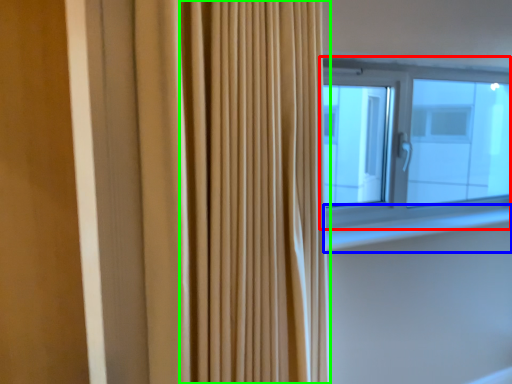
Question: Which is nearer to the window (highlighted by a red box)? window sill (highlighted by a blue box) or shower curtain (highlighted by a green box).

Choices:
 (A) window sill
 (B) shower curtain

Answer: (A)